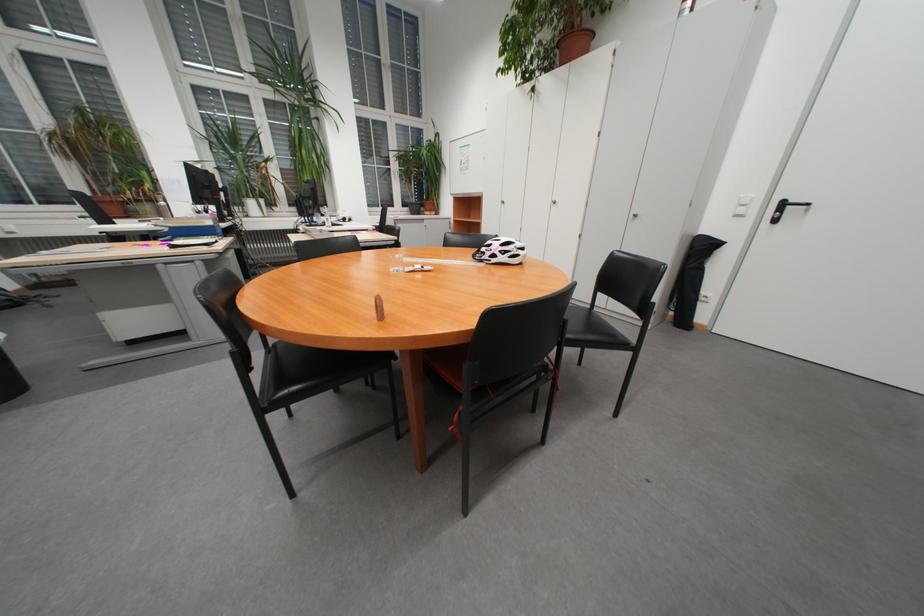
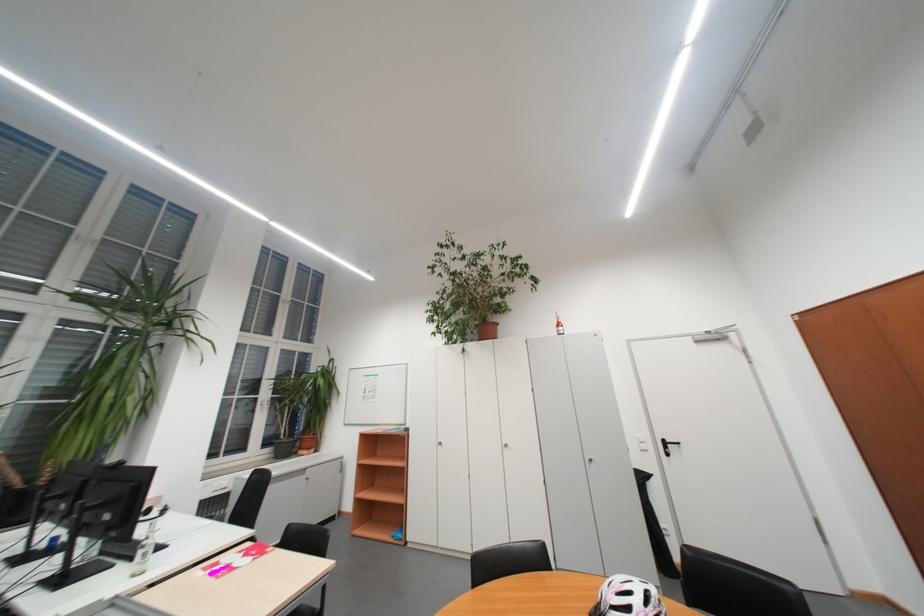
In the second image, find the point that corresponds to the point at 795,205 in the first image.

(676, 444)